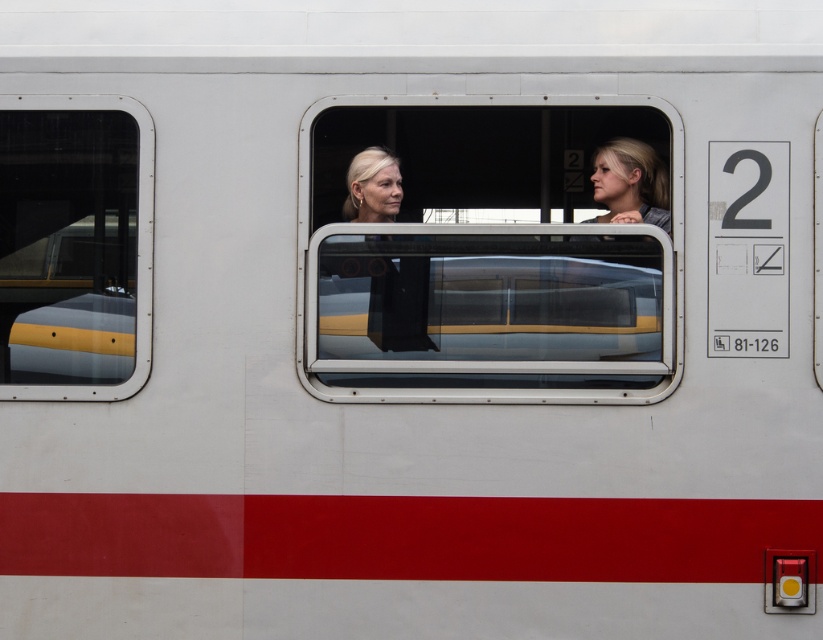
Question: Which object is closer to the camera taking this photo?

Choices:
 (A) matte black hair at center
 (B) clear glass train window at left

Answer: (B)

Question: Can you confirm if transparent glass train window at center is thinner than smooth blonde hair at center?

Choices:
 (A) no
 (B) yes

Answer: (A)

Question: Which object is closer to the camera taking this photo?

Choices:
 (A) clear glass train window at left
 (B) matte black hair at center
 (C) transparent glass train window at center

Answer: (C)

Question: Observing the image, what is the correct spatial positioning of clear glass train window at left in reference to smooth blonde hair at center?

Choices:
 (A) left
 (B) right

Answer: (A)

Question: Is the position of transparent glass train window at center less distant than that of matte black hair at center?

Choices:
 (A) no
 (B) yes

Answer: (B)

Question: Which object is positioned farthest from the matte black hair at center?

Choices:
 (A) clear glass train window at left
 (B) smooth blonde hair at center

Answer: (A)